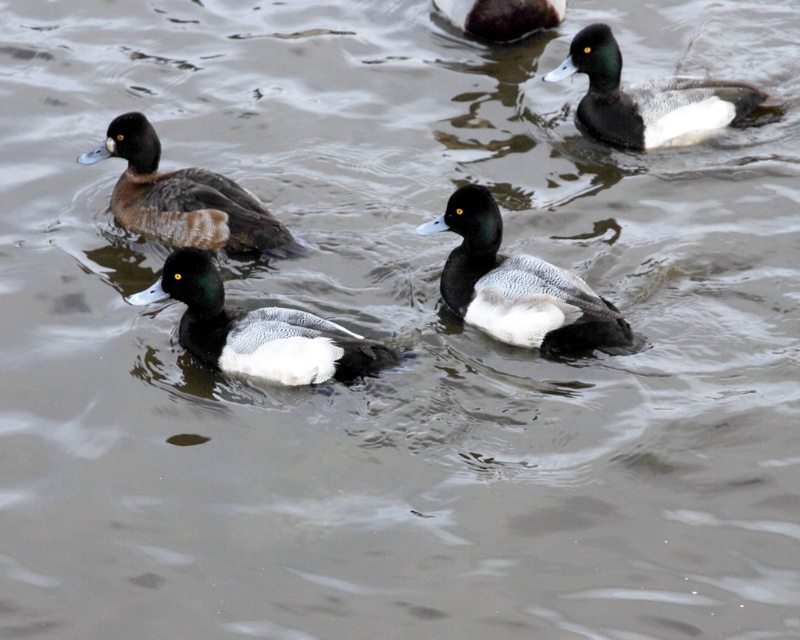
You are a wildlife photographer aiming to capture a photo of the black matte duck at center and the black matte duck at upper center. Which duck should you focus on to ensure you can fit both ducks in the frame without cropping, considering their sizes?

The black matte duck at center is wider than the black matte duck at upper center. Therefore, focusing on the black matte duck at center will ensure both ducks fit in the frame since it is the larger one and requires more space.

You are standing at the edge of the water where the ducks are swimming. You want to throw a small pebble to hit the point marked as point (458, 305). Considering the distance, can you estimate if you can reach that point with your throw?

The point (458, 305) is 15.91 feet away from the viewer. The average throwing distance for a small pebble is around 20 feet, so it is possible to reach the point with a strong throw.

You are a wildlife photographer trying to capture a closeup of the black matte duck at center and the matte black duck at center. Which duck should you focus on if you want to photograph the taller one?

The black matte duck at center is taller than the matte black duck at center, so you should focus on the black matte duck at center.